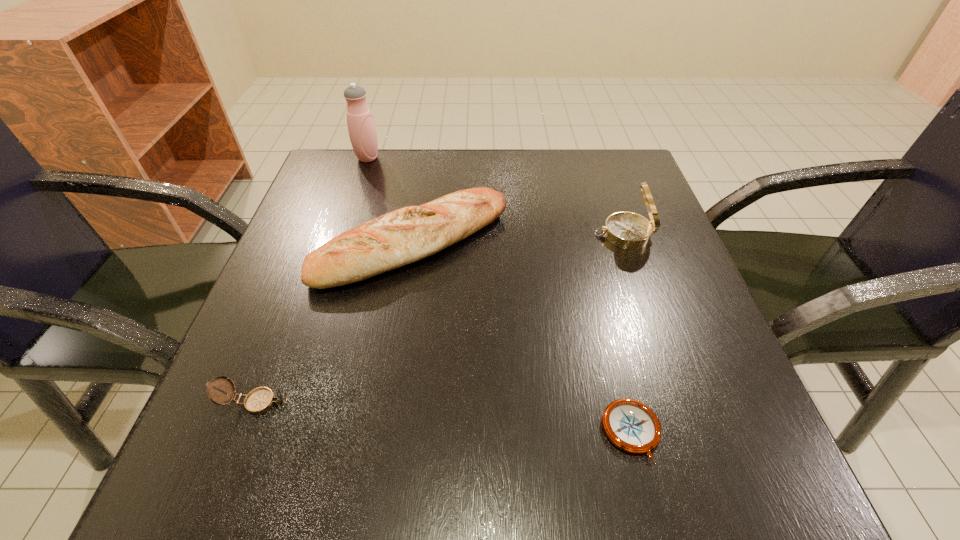
Locate an element on the screen. vacant space at the far right corner of the desktop is located at coordinates (569, 163).

Find the location of a particular element. This screenshot has height=540, width=960. free spot between the shortest object and the leftmost compass is located at coordinates (444, 417).

I want to click on free area in between the tallest compass and the second shortest object, so click(440, 319).

The image size is (960, 540). I want to click on free point between the leftmost compass and the fourth shortest object, so click(x=440, y=319).

Identify the location of free space between the second tallest object and the shortest object. Image resolution: width=960 pixels, height=540 pixels. (628, 333).

Locate an element on the screen. The width and height of the screenshot is (960, 540). vacant region between the tallest compass and the second tallest compass is located at coordinates (440, 319).

Where is `vacant space that is in between the shortest object and the second shortest object`? This screenshot has width=960, height=540. vacant space that is in between the shortest object and the second shortest object is located at coordinates click(444, 417).

Identify the location of vacant region between the shortest compass and the baguet. (522, 339).

Where is `free space between the farthest object and the baguet`? The height and width of the screenshot is (540, 960). free space between the farthest object and the baguet is located at coordinates (391, 201).

Locate which object is the fourth closest to the farthest object. Please provide its 2D coordinates. Your answer should be formatted as a tuple, i.e. [(x, y)], where the tuple contains the x and y coordinates of a point satisfying the conditions above.

[(632, 426)]